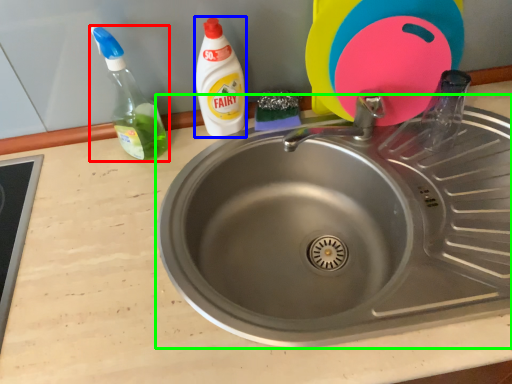
Question: Which object is positioned farthest from bottle (highlighted by a red box)? Select from cleaning product (highlighted by a blue box) and sink (highlighted by a green box).

Choices:
 (A) cleaning product
 (B) sink

Answer: (B)